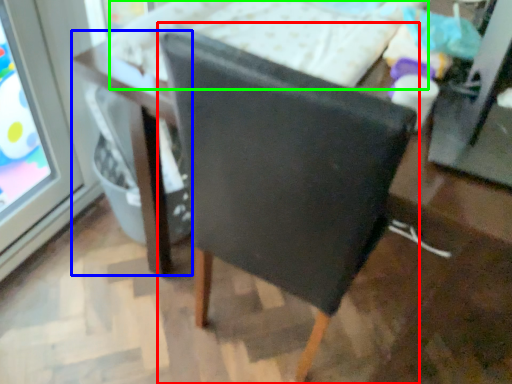
Question: Based on their relative distances, which object is nearer to chair (highlighted by a red box)? Choose from table (highlighted by a blue box) and bed (highlighted by a green box).

Choices:
 (A) table
 (B) bed

Answer: (A)